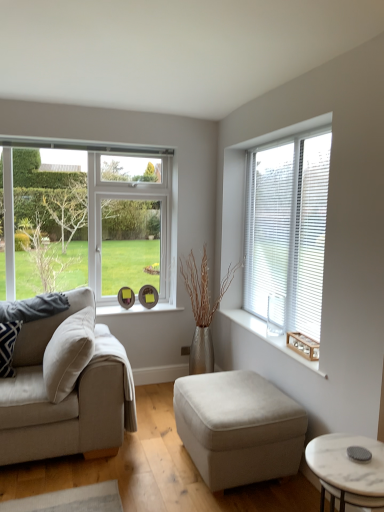
At what (x,y) coordinates should I click in order to perform the action: click on beige fabric couch at left. Please return your answer as a coordinate pair (x, y). Looking at the image, I should click on (65, 397).

What is the approximate width of beige fabric couch at left?

beige fabric couch at left is 1.04 meters in width.

Measure the distance between point (34, 212) and camera.

11.87 feet.

This screenshot has width=384, height=512. What do you see at coordinates (238, 426) in the screenshot? I see `beige fabric ottoman at center` at bounding box center [238, 426].

Describe the element at coordinates (288, 228) in the screenshot. I see `white blinds at upper right, arranged as the first window when viewed from the right` at that location.

The width and height of the screenshot is (384, 512). What do you see at coordinates (8, 346) in the screenshot?
I see `patterned fabric pillow at left` at bounding box center [8, 346].

The height and width of the screenshot is (512, 384). I want to click on beige fabric couch at left, so click(65, 397).

Considering the positions of objects clear glass window at left, which appears as the 1th window when viewed from the left, and beige fabric couch at left in the image provided, who is behind, clear glass window at left, which appears as the 1th window when viewed from the left, or beige fabric couch at left?

Positioned behind is clear glass window at left, which appears as the 1th window when viewed from the left.

Is clear glass window at left, marked as the second window in a right-to-left arrangement, inside or outside of beige fabric couch at left?

clear glass window at left, marked as the second window in a right-to-left arrangement, is spatially situated outside beige fabric couch at left.

Which point is more distant from viewer, (87,217) or (21,375)?

The point (87,217) is more distant.

Considering the positions of objects patterned fabric pillow at left and clear glass window at left, which appears as the 1th window when viewed from the left, in the image provided, who is more to the right, patterned fabric pillow at left or clear glass window at left, which appears as the 1th window when viewed from the left,?

From the viewer's perspective, clear glass window at left, which appears as the 1th window when viewed from the left, appears more on the right side.

Would you say patterned fabric pillow at left is a long distance from clear glass window at left, which appears as the 1th window when viewed from the left?

Yes, patterned fabric pillow at left and clear glass window at left, which appears as the 1th window when viewed from the left, are located far from each other.

Is patterned fabric pillow at left facing towards clear glass window at left, which appears as the 1th window when viewed from the left?

No, patterned fabric pillow at left is not aimed at clear glass window at left, which appears as the 1th window when viewed from the left.

Relative to clear glass window at left, which appears as the 1th window when viewed from the left, is patterned fabric pillow at left in front or behind?

Clearly, patterned fabric pillow at left is in front of clear glass window at left, which appears as the 1th window when viewed from the left.

From a real-world perspective, who is located lower, patterned fabric pillow at left or beige fabric ottoman at center?

From a 3D spatial view, beige fabric ottoman at center is below.

Which object is closer to the camera taking this photo, patterned fabric pillow at left or beige fabric ottoman at center?

Positioned in front is beige fabric ottoman at center.

Considering the relative positions of patterned fabric pillow at left and beige fabric ottoman at center in the image provided, is patterned fabric pillow at left to the right of beige fabric ottoman at center from the viewer's perspective?

In fact, patterned fabric pillow at left is to the left of beige fabric ottoman at center.

This screenshot has width=384, height=512. Identify the location of pillow above the beige fabric ottoman at center (from a real-world perspective). (8, 346).

Considering the sizes of objects wooden window sill at right and beige fabric ottoman at center in the image provided, who is wider, wooden window sill at right or beige fabric ottoman at center?

With larger width is beige fabric ottoman at center.

From the image's perspective, which one is positioned higher, wooden window sill at right or beige fabric ottoman at center?

wooden window sill at right is shown above in the image.

Is wooden window sill at right inside the boundaries of beige fabric ottoman at center, or outside?

wooden window sill at right is spatially situated outside beige fabric ottoman at center.

Can you confirm if wooden window sill at right is bigger than beige fabric ottoman at center?

No.

Is white marble coffee table at lower right at the left side of wooden window sill at right?

No.

In terms of width, does white marble coffee table at lower right look wider or thinner when compared to wooden window sill at right?

white marble coffee table at lower right is wider than wooden window sill at right.

Is white marble coffee table at lower right oriented towards wooden window sill at right?

No, white marble coffee table at lower right is not aimed at wooden window sill at right.

Are white marble coffee table at lower right and wooden window sill at right located far from each other?

→ No, there isn't a large distance between white marble coffee table at lower right and wooden window sill at right.

Between white blinds at upper right, which is the second window in left-to-right order, and clear glass window at left, which appears as the 1th window when viewed from the left, which one has smaller size?

white blinds at upper right, which is the second window in left-to-right order, is smaller.

Is point (325, 130) closer to viewer compared to point (133, 215)?

Yes, it is.

In the image, there is a white blinds at upper right, which is the second window in left-to-right order. Identify the location of window below it (from a real-world perspective). (87, 222).

From the image's perspective, which is below, beige fabric couch at left or white blinds at upper right, arranged as the first window when viewed from the right?

beige fabric couch at left is shown below in the image.

Which is more to the left, beige fabric couch at left or white blinds at upper right, which is the second window in left-to-right order?

Positioned to the left is beige fabric couch at left.

From a real-world perspective, is beige fabric couch at left on top of white blinds at upper right, arranged as the first window when viewed from the right?

No, from a real-world perspective, beige fabric couch at left is not above white blinds at upper right, arranged as the first window when viewed from the right.

Does beige fabric couch at left have a smaller size compared to white blinds at upper right, which is the second window in left-to-right order?

Actually, beige fabric couch at left might be larger than white blinds at upper right, which is the second window in left-to-right order.

From the beige fabric couch at left, count 2nd windows backward and point to it. Please provide its 2D coordinates.

[(87, 222)]

Starting from the patterned fabric pillow at left, which window is the 1st one to the right? Please provide its 2D coordinates.

[(87, 222)]

Considering their positions, is clear glass window at left, marked as the second window in a right-to-left arrangement, positioned closer to wooden window sill at right than beige fabric couch at left?

Based on the image, beige fabric couch at left appears to be nearer to wooden window sill at right.

Looking at the image, which one is located further to clear glass window at left, which appears as the 1th window when viewed from the left, white marble coffee table at lower right or wooden window sill at right?

white marble coffee table at lower right is positioned further to the anchor clear glass window at left, which appears as the 1th window when viewed from the left.

Consider the image. Looking at the image, which one is located further to white marble coffee table at lower right, wooden window sill at right or white blinds at upper right, arranged as the first window when viewed from the right?

Among the two, white blinds at upper right, arranged as the first window when viewed from the right, is located further to white marble coffee table at lower right.

From the image, which object appears to be nearer to white marble coffee table at lower right, wooden window sill at right or patterned fabric pillow at left?

The object closer to white marble coffee table at lower right is wooden window sill at right.

Based on their spatial positions, is patterned fabric pillow at left or beige fabric couch at left closer to wooden window sill at right?

Among the two, beige fabric couch at left is located nearer to wooden window sill at right.

Which object lies further to the anchor point clear glass window at left, marked as the second window in a right-to-left arrangement, patterned fabric pillow at left or beige fabric ottoman at center?

beige fabric ottoman at center.

Estimate the real-world distances between objects in this image. Which object is further from clear glass window at left, marked as the second window in a right-to-left arrangement, wooden window sill at right or white marble coffee table at lower right?

white marble coffee table at lower right lies further to clear glass window at left, marked as the second window in a right-to-left arrangement, than the other object.

Looking at the image, which one is located closer to beige fabric ottoman at center, wooden window sill at right or white blinds at upper right, arranged as the first window when viewed from the right?

wooden window sill at right is positioned closer to the anchor beige fabric ottoman at center.

Find the location of `stool situated between patterned fabric pillow at left and white marble coffee table at lower right from left to right`. stool situated between patterned fabric pillow at left and white marble coffee table at lower right from left to right is located at coordinates (238, 426).

At what (x,y) coordinates should I click in order to perform the action: click on pillow between beige fabric couch at left and clear glass window at left, which appears as the 1th window when viewed from the left, from front to back. Please return your answer as a coordinate pair (x, y). The width and height of the screenshot is (384, 512). Looking at the image, I should click on (8, 346).

This screenshot has height=512, width=384. I want to click on window situated between patterned fabric pillow at left and wooden window sill at right from left to right, so click(87, 222).

Where is `studio couch located between patterned fabric pillow at left and white marble coffee table at lower right in the left-right direction`? The height and width of the screenshot is (512, 384). studio couch located between patterned fabric pillow at left and white marble coffee table at lower right in the left-right direction is located at coordinates (65, 397).